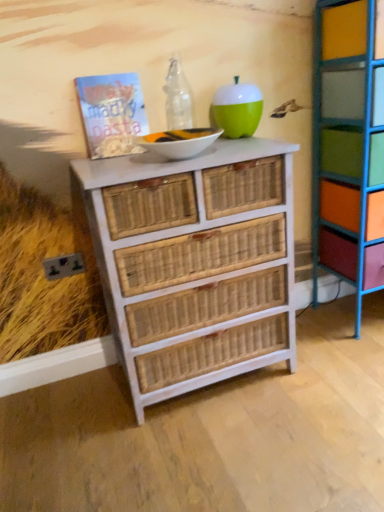
Where is `free space in front of multicolored painted wood shelf at right`? The height and width of the screenshot is (512, 384). free space in front of multicolored painted wood shelf at right is located at coordinates (353, 358).